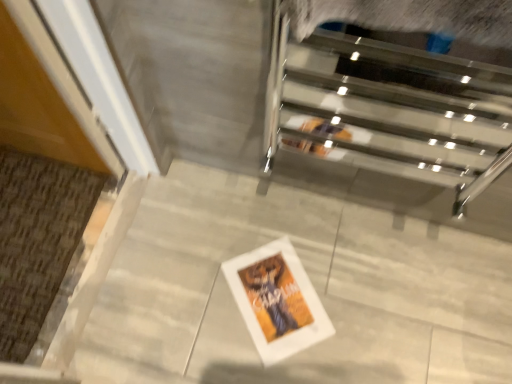
Locate an element on the screen. vacant space to the right of white matte picture frame at center is located at coordinates (351, 296).